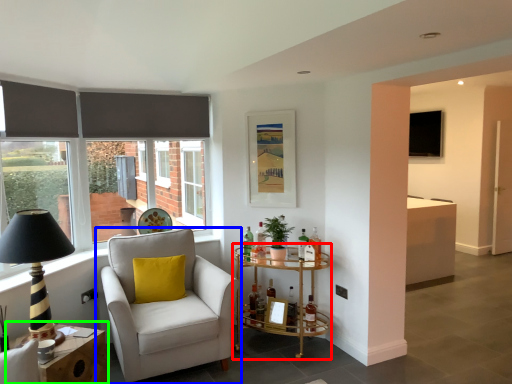
Question: Based on their relative distances, which object is farther from table (highlighted by a red box)? Choose from chair (highlighted by a blue box) and table (highlighted by a green box).

Choices:
 (A) chair
 (B) table

Answer: (B)